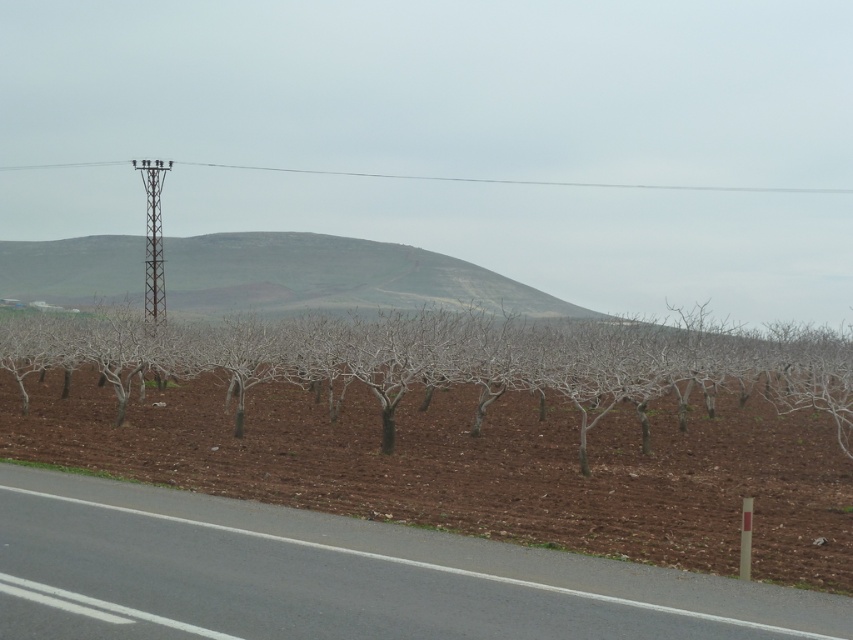
Question: Is gray textured hillside at center behind metallic wire at upper center?

Choices:
 (A) no
 (B) yes

Answer: (A)

Question: Which point appears closest to the camera in this image?

Choices:
 (A) pyautogui.click(x=851, y=189)
 (B) pyautogui.click(x=67, y=276)
 (C) pyautogui.click(x=697, y=340)

Answer: (C)

Question: In this image, where is bare branches at center located relative to metallic wire at upper center?

Choices:
 (A) right
 (B) left

Answer: (B)

Question: Considering the real-world distances, which object is farthest from the gray textured hillside at center?

Choices:
 (A) metallic wire at upper center
 (B) bare branches at center

Answer: (A)

Question: Considering the real-world distances, which object is closest to the gray textured hillside at center?

Choices:
 (A) metallic wire at upper center
 (B) bare branches at center

Answer: (B)

Question: Is bare branches at center above metallic wire at upper center?

Choices:
 (A) yes
 (B) no

Answer: (B)